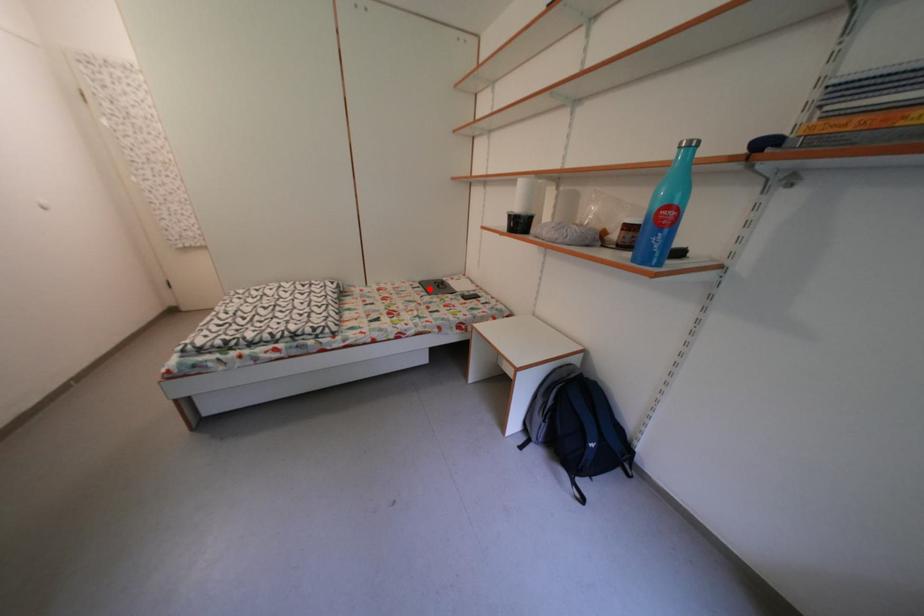
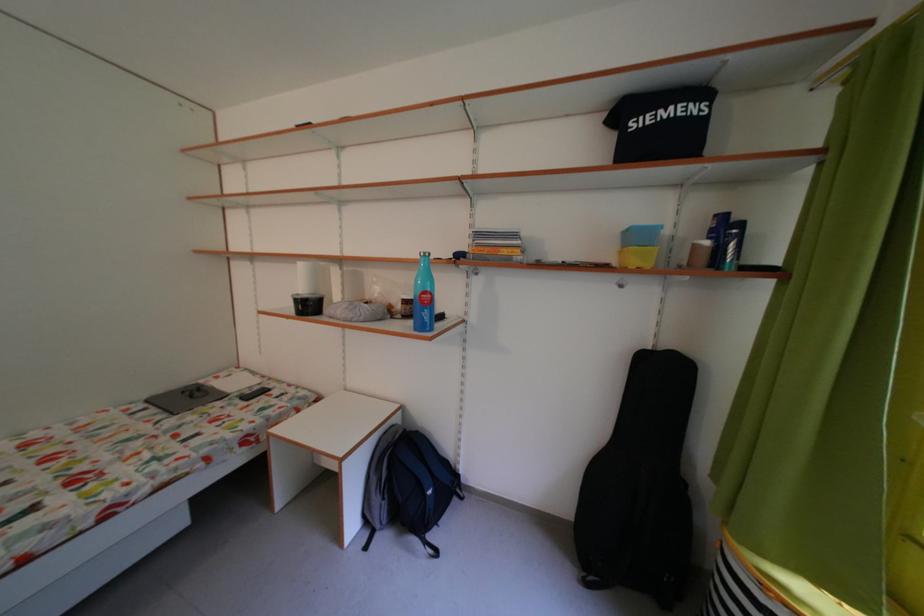
Locate, in the second image, the point that corresponds to the highlighted location in the first image.

(156, 407)